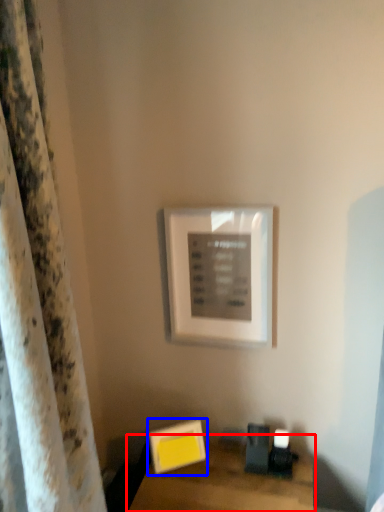
Question: Which of the following is the farthest to the observer, table (highlighted by a red box) or picture frame (highlighted by a blue box)?

Choices:
 (A) table
 (B) picture frame

Answer: (B)